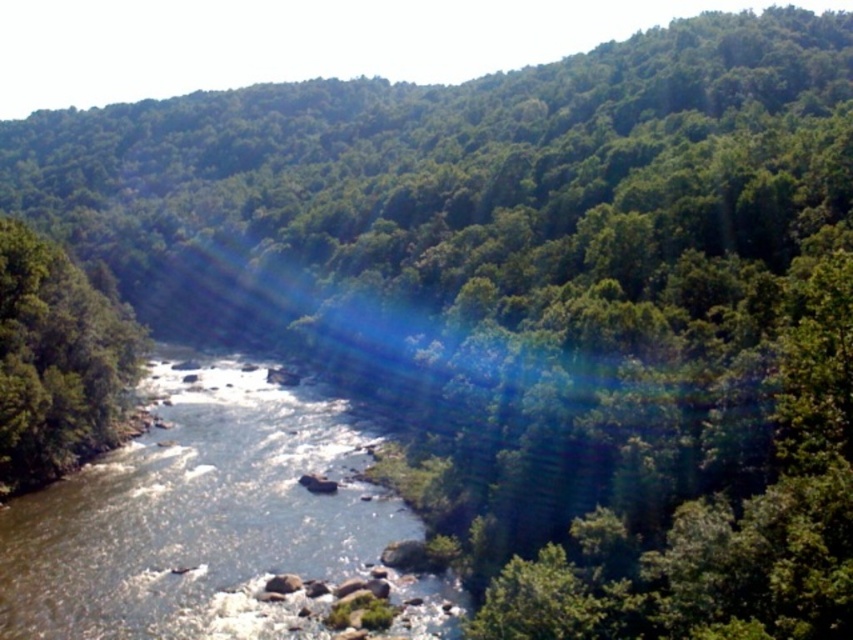
You are standing at the bottom left corner of the river and want to reach the green leafy tree at left. Which direction should you move relative to the clear water at center?

To reach the green leafy tree at left from the bottom left corner of the river, you should move to the left of the clear water at center since the clear water at center is to the right of green leafy tree at left.

You are a hiker who wants to cross the river. You see the clear water at center and the green leafy tree at left. Which one is closer to the ground?

The clear water at center is shorter than the green leafy tree at left, so the clear water at center is closer to the ground.

You are a photographer planning to capture the clear water at center and the green leafy tree at left in a single shot. Based on their sizes in the image, which object would you need to focus on more carefully to ensure it appears sharp and detailed?

The green leafy tree at left is larger than the clear water at center, so focusing on the larger object might require more attention to ensure sharpness and detail.